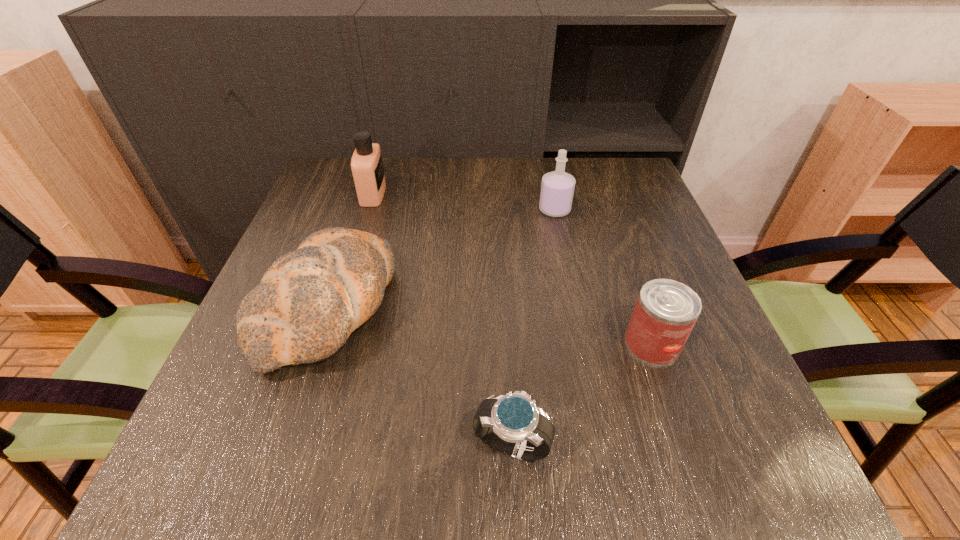
Identify the location of vacant area situated on the right of the third object from left to right. (668, 444).

The width and height of the screenshot is (960, 540). Identify the location of object at the near edge. (512, 424).

I want to click on perfume that is positioned at the left edge, so click(367, 168).

The height and width of the screenshot is (540, 960). What are the coordinates of `bread located at the left edge` in the screenshot? It's located at (309, 301).

This screenshot has width=960, height=540. What are the coordinates of `object present at the right edge` in the screenshot? It's located at (666, 311).

Find the location of a particular element. Image resolution: width=960 pixels, height=540 pixels. object present at the far left corner is located at coordinates (367, 168).

You are a GUI agent. You are given a task and a screenshot of the screen. Output one action in this format:
    pyautogui.click(x=<x>, y=<y>)
    Task: Click on the vacant space at the far edge of the desktop
    The width and height of the screenshot is (960, 540).
    Given the screenshot: What is the action you would take?
    pyautogui.click(x=413, y=173)

Where is `free space at the near edge of the desktop`? The image size is (960, 540). free space at the near edge of the desktop is located at coordinates (449, 456).

Identify the location of vacant area at the left edge of the desktop. (218, 386).

The height and width of the screenshot is (540, 960). In the image, there is a desktop. Find the location of `vacant area at the right edge`. vacant area at the right edge is located at coordinates (666, 406).